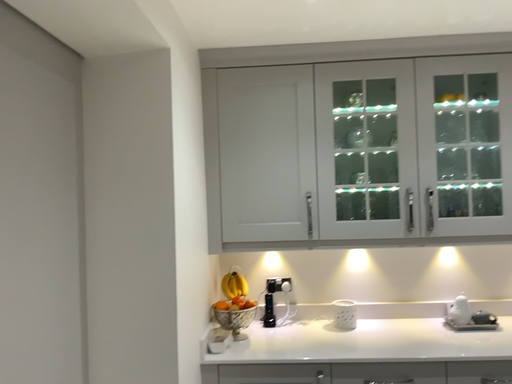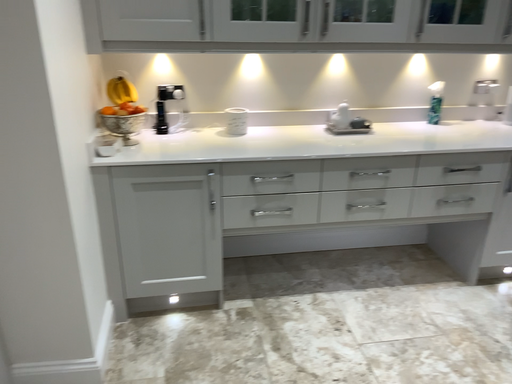
Question: How did the camera likely rotate when shooting the video?

Choices:
 (A) rotated left
 (B) rotated right

Answer: (B)